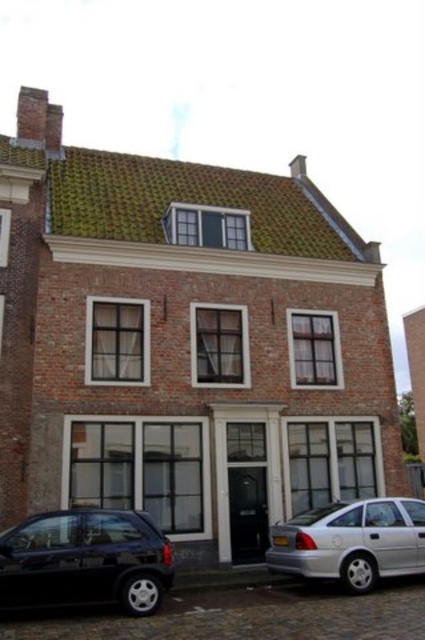
You are a delivery person trying to park your shiny black car at lower left and silver metallic sedan at lower right in front of the Dutch brick building. The parking space can only accommodate one vehicle at a time. Based on their sizes, which car should you park first to ensure both can fit without overlapping?

The shiny black car at lower left has a smaller width than the silver metallic sedan at lower right. Therefore, you should park the silver metallic sedan at lower right first, as it is wider, ensuring there is enough space left for the smaller shiny black car at lower left.

You are a visitor arriving at this Dutch building and need to park your car. The shiny black car at lower left and the silver metallic sedan at lower right are already parked. Based on their positions, which side of the road should you choose to park on?

Since the shiny black car at lower left is to the left of the silver metallic sedan at lower right, you should park on the left side of the road following the existing parking pattern.

You are a delivery driver who needs to park your vehicle in front of the Dutch brick building. You have a shiny black car at lower left and a silver metallic sedan at lower right. Which vehicle has more space available for parking next to it?

The silver metallic sedan at lower right is larger than the shiny black car at lower left, so there is more space available next to it for parking.